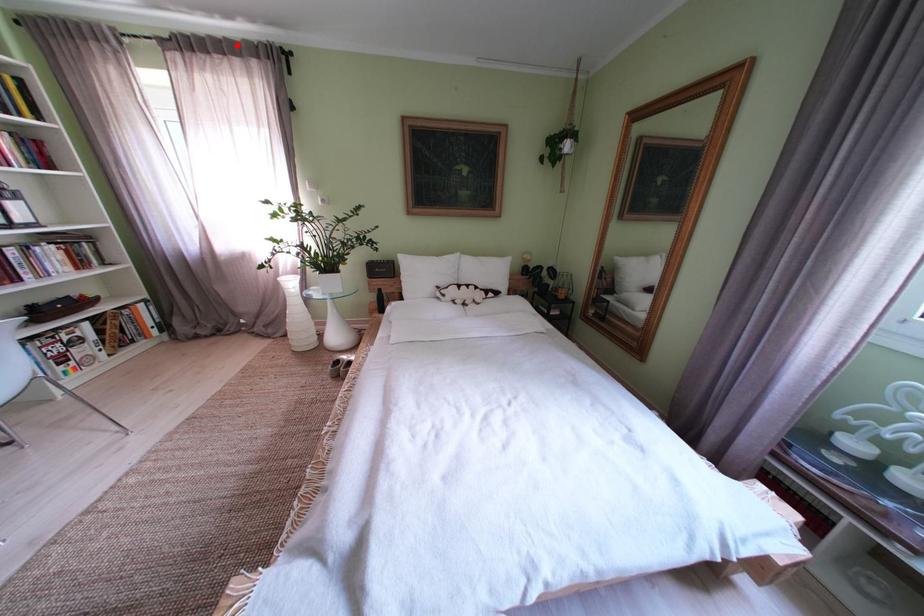
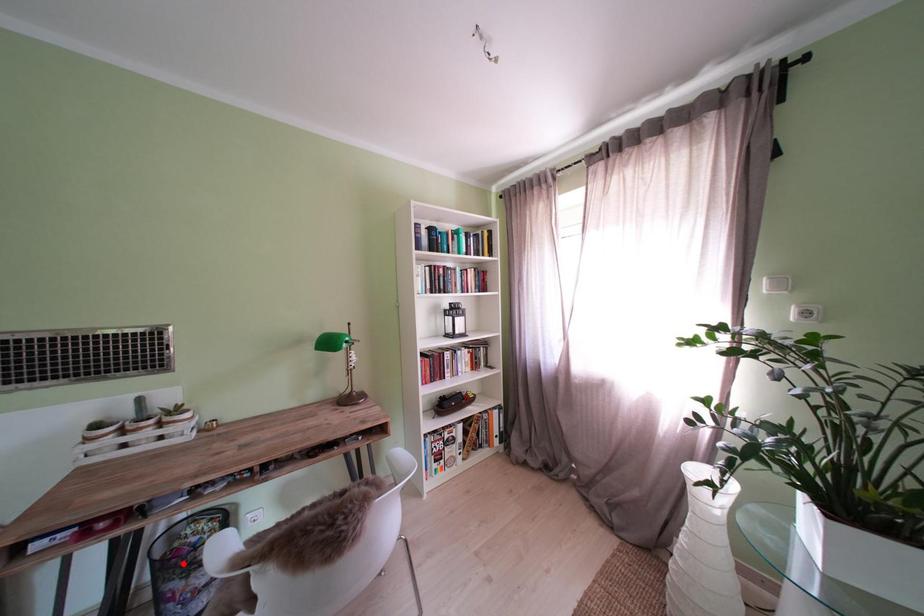
I am providing you with two images of the same scene from different viewpoints. A red point is marked on the first image and another point is marked on the second image. Does the point marked in image1 correspond to the same location as the one in image2?

No